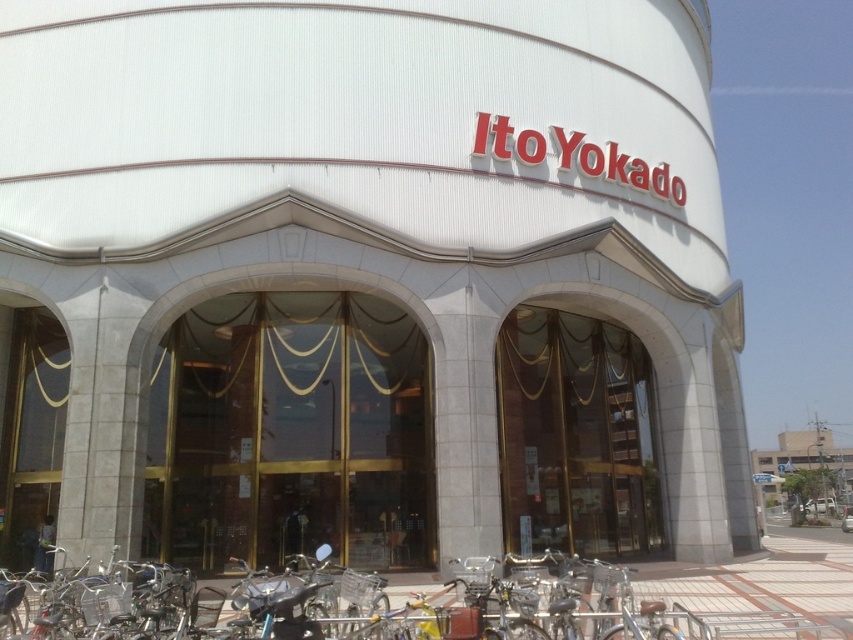
Question: Does silver metallic bicycle at lower center appear under white glass building at center?

Choices:
 (A) no
 (B) yes

Answer: (A)

Question: Which of the following is the farthest from the observer?

Choices:
 (A) silver metallic bicycle at lower center
 (B) white glass building at center

Answer: (B)

Question: Which point is farther to the camera?

Choices:
 (A) (273, 636)
 (B) (849, 468)

Answer: (B)

Question: Observing the image, what is the correct spatial positioning of silver metallic bicycle at lower center in reference to white glass building at center?

Choices:
 (A) below
 (B) above

Answer: (B)

Question: Which point is closer to the camera?

Choices:
 (A) silver metallic bicycle at lower center
 (B) white glass building at center

Answer: (A)

Question: Is the position of silver metallic bicycle at lower center more distant than that of white glass building at center?

Choices:
 (A) no
 (B) yes

Answer: (A)